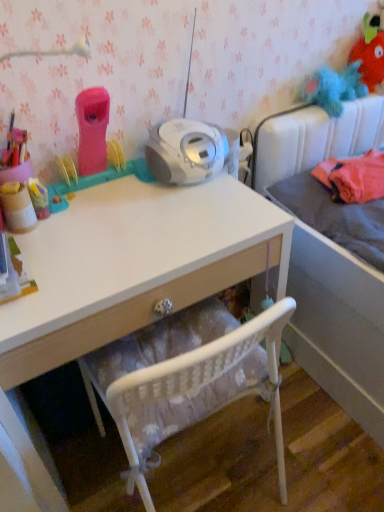
Locate an element on the screen. Image resolution: width=384 pixels, height=512 pixels. white glossy desk at center is located at coordinates (127, 276).

What is the approximate width of gray fabric bed at upper right?

gray fabric bed at upper right is 31.54 inches wide.

Image resolution: width=384 pixels, height=512 pixels. What do you see at coordinates (338, 325) in the screenshot?
I see `gray fabric bed at upper right` at bounding box center [338, 325].

What is the approximate width of gray fabric mattress at right?

19.70 inches.

Find the location of a particular element. The image size is (384, 512). gray fabric mattress at right is located at coordinates (335, 216).

What is the approximate width of blue plush toy at upper right, which is the second toy in front-to-back order?

6.48 inches.

Find the location of a particular element. white glossy desk at center is located at coordinates (127, 276).

From a real-world perspective, is matte brown jar at left, which is counted as the third toy, starting from the right, physically below white glossy desk at center?

No, from a real-world perspective, matte brown jar at left, which is counted as the third toy, starting from the right, is not below white glossy desk at center.

Who is more distant, matte brown jar at left, which appears as the third toy when viewed from the back, or white glossy desk at center?

matte brown jar at left, which appears as the third toy when viewed from the back.

Considering the positions of objects matte brown jar at left, which ranks as the 1th toy in left-to-right order, and white glossy desk at center in the image provided, who is more to the right, matte brown jar at left, which ranks as the 1th toy in left-to-right order, or white glossy desk at center?

white glossy desk at center.

Is matte brown jar at left, which appears as the third toy when viewed from the back, facing towards white glossy desk at center?

No, matte brown jar at left, which appears as the third toy when viewed from the back, does not turn towards white glossy desk at center.

Is fluffy plush toy at upper right, positioned as the 3th toy in bottom-to-top order, to the right of white glossy desk at center from the viewer's perspective?

Indeed, fluffy plush toy at upper right, positioned as the 3th toy in bottom-to-top order, is positioned on the right side of white glossy desk at center.

Does fluffy plush toy at upper right, the first toy positioned from the right, contain white glossy desk at center?

That's incorrect, white glossy desk at center is not inside fluffy plush toy at upper right, the first toy positioned from the right.

From the image's perspective, which is below, gray fabric bed at upper right or matte brown jar at left, which ranks as the 1th toy in left-to-right order?

gray fabric bed at upper right, from the image's perspective.

Is gray fabric bed at upper right not near matte brown jar at left, which is the first toy from front to back?

That's not correct — gray fabric bed at upper right is a little close to matte brown jar at left, which is the first toy from front to back.

In terms of height, does gray fabric bed at upper right look taller or shorter compared to matte brown jar at left, placed as the third toy when sorted from top to bottom?

gray fabric bed at upper right is taller than matte brown jar at left, placed as the third toy when sorted from top to bottom.

Which toy is the 3rd one when counting from the left side of the gray fabric bed at upper right? Please provide its 2D coordinates.

[(17, 207)]

Is white glossy desk at center in contact with gray fabric mattress at right?

No, white glossy desk at center is not with gray fabric mattress at right.

Which point is more distant from viewer, (17, 322) or (282, 203)?

Positioned behind is point (282, 203).

Locate an element on the screen. Image resolution: width=384 pixels, height=512 pixels. mattress above the white glossy desk at center (from the image's perspective) is located at coordinates (335, 216).

From the image's perspective, would you say white glossy desk at center is positioned over gray fabric mattress at right?

Incorrect, from the image's perspective, white glossy desk at center is lower than gray fabric mattress at right.

Could you tell me if matte brown jar at left, which appears as the third toy when viewed from the back, is facing gray fabric bed at upper right?

No, matte brown jar at left, which appears as the third toy when viewed from the back, is not oriented towards gray fabric bed at upper right.

Which of these two, matte brown jar at left, which ranks as the 1th toy in left-to-right order, or gray fabric bed at upper right, stands shorter?

With less height is matte brown jar at left, which ranks as the 1th toy in left-to-right order.

Considering the positions of objects matte brown jar at left, placed as the third toy when sorted from top to bottom, and gray fabric bed at upper right in the image provided, who is more to the right, matte brown jar at left, placed as the third toy when sorted from top to bottom, or gray fabric bed at upper right?

From the viewer's perspective, gray fabric bed at upper right appears more on the right side.

Considering the relative positions of matte brown jar at left, which ranks as the 1th toy in left-to-right order, and gray fabric bed at upper right in the image provided, is matte brown jar at left, which ranks as the 1th toy in left-to-right order, behind gray fabric bed at upper right?

Yes, matte brown jar at left, which ranks as the 1th toy in left-to-right order, is further from the viewer.

Is matte brown jar at left, which is counted as the third toy, starting from the right, situated inside gray fabric mattress at right or outside?

matte brown jar at left, which is counted as the third toy, starting from the right, exists outside the volume of gray fabric mattress at right.

Considering the positions of objects matte brown jar at left, which is counted as the third toy, starting from the right, and gray fabric mattress at right in the image provided, who is in front, matte brown jar at left, which is counted as the third toy, starting from the right, or gray fabric mattress at right?

matte brown jar at left, which is counted as the third toy, starting from the right, is more forward.

From the image's perspective, between matte brown jar at left, which is counted as the third toy, starting from the right, and gray fabric mattress at right, who is located below?

matte brown jar at left, which is counted as the third toy, starting from the right, appears lower in the image.

Which is nearer, [10,198] or [371,206]?

Positioned in front is point [10,198].

Are gray fabric mattress at right and blue plush toy at upper right, which is the second toy in front-to-back order, beside each other?

No, gray fabric mattress at right is not making contact with blue plush toy at upper right, which is the second toy in front-to-back order.

Who is more distant, gray fabric mattress at right or blue plush toy at upper right, the 2th toy when ordered from left to right?

blue plush toy at upper right, the 2th toy when ordered from left to right.

Which is more to the left, gray fabric mattress at right or blue plush toy at upper right, which is the second toy in front-to-back order?

Positioned to the left is blue plush toy at upper right, which is the second toy in front-to-back order.

Does gray fabric mattress at right have a greater width compared to blue plush toy at upper right, which is the second toy from right to left?

Indeed, gray fabric mattress at right has a greater width compared to blue plush toy at upper right, which is the second toy from right to left.

Locate an element on the screen. desk in front of the matte brown jar at left, which is counted as the third toy, starting from the right is located at coordinates (127, 276).

The height and width of the screenshot is (512, 384). I want to click on desk on the left of the fluffy plush toy at upper right, the first toy positioned from the right, so click(x=127, y=276).

Based on their spatial positions, is matte brown jar at left, placed as the third toy when sorted from top to bottom, or gray fabric mattress at right closer to white glossy desk at center?

Among the two, matte brown jar at left, placed as the third toy when sorted from top to bottom, is located nearer to white glossy desk at center.

From the image, which object appears to be nearer to gray fabric bed at upper right, fluffy plush toy at upper right, placed as the first toy when sorted from back to front, or gray fabric mattress at right?

The object closer to gray fabric bed at upper right is gray fabric mattress at right.

Which object lies further to the anchor point fluffy plush toy at upper right, placed as the first toy when sorted from back to front, gray fabric mattress at right or blue plush toy at upper right, which is the second toy in front-to-back order?

Among the two, gray fabric mattress at right is located further to fluffy plush toy at upper right, placed as the first toy when sorted from back to front.

Which object lies nearer to the anchor point gray fabric bed at upper right, fluffy plush toy at upper right, the 3th toy viewed from the front, or white glossy desk at center?

white glossy desk at center is closer to gray fabric bed at upper right.

From the image, which object appears to be nearer to gray fabric mattress at right, matte brown jar at left, marked as the 1th toy in a bottom-to-top arrangement, or white glossy desk at center?

white glossy desk at center is positioned closer to the anchor gray fabric mattress at right.

Based on their spatial positions, is blue plush toy at upper right, the 2th toy positioned from the bottom, or fluffy plush toy at upper right, which appears as the first toy when viewed from the top, further from gray fabric mattress at right?

The object further to gray fabric mattress at right is fluffy plush toy at upper right, which appears as the first toy when viewed from the top.

Looking at this image, estimate the real-world distances between objects in this image. Which object is further from gray fabric mattress at right, gray fabric bed at upper right or fluffy plush toy at upper right, placed as the first toy when sorted from back to front?

fluffy plush toy at upper right, placed as the first toy when sorted from back to front.

Which object lies nearer to the anchor point white glossy desk at center, blue plush toy at upper right, which is the second toy in front-to-back order, or gray fabric bed at upper right?

gray fabric bed at upper right lies closer to white glossy desk at center than the other object.

The width and height of the screenshot is (384, 512). Identify the location of desk between matte brown jar at left, marked as the 1th toy in a bottom-to-top arrangement, and fluffy plush toy at upper right, positioned as the 3th toy in bottom-to-top order. (127, 276).

This screenshot has width=384, height=512. I want to click on mattress between matte brown jar at left, placed as the third toy when sorted from top to bottom, and fluffy plush toy at upper right, the 3th toy viewed from the front, from left to right, so tap(335, 216).

At what (x,y) coordinates should I click in order to perform the action: click on mattress located between white glossy desk at center and fluffy plush toy at upper right, which appears as the first toy when viewed from the top, in the left-right direction. Please return your answer as a coordinate pair (x, y). Image resolution: width=384 pixels, height=512 pixels. Looking at the image, I should click on (335, 216).

What are the coordinates of `mattress between blue plush toy at upper right, acting as the second toy starting from the back, and gray fabric bed at upper right vertically` in the screenshot? It's located at (335, 216).